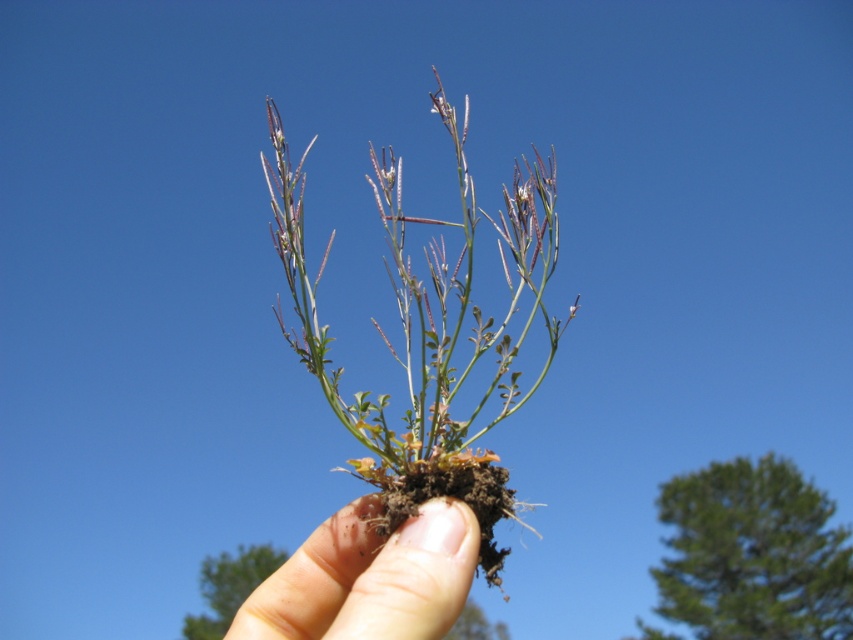
Based on the photo, you are a gardener holding a green leafy plant at center in your smooth skin hand at center. You need to place the plant into a pot that is 10 cm wide. Can the plant fit into the pot based on their sizes?

The green leafy plant at center is larger in width than the smooth skin hand at center. Since the hand is presumably wider than 10 cm, the plant may not fit into the 10 cm wide pot.

You are a photographer trying to capture the green leafy plant at center. Since the smooth skin hand at center is holding it, can you adjust your camera to focus on the plant without the hand being in the way?

The smooth skin hand at center is behind the green leafy plant at center, so adjusting the camera focus to the plant will keep the hand out of the way and in the background.

You are a photographer trying to capture the plant in focus. You notice two points in the scene at coordinates point (380, 477) and point (430, 627). Which point should you focus on to ensure the plant is sharp?

You should focus on point (380, 477) because it is closer to the camera than point (430, 627), ensuring the plant is in sharp focus.